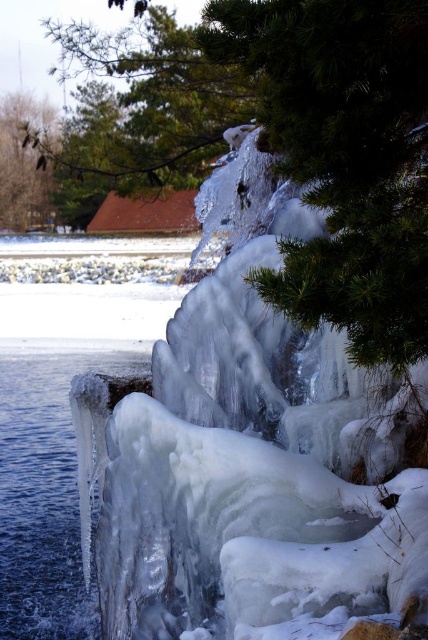
You are an ice climber planning to set up a safety anchor between the clear ice water at lower left and the green textured pine branch at upper left. Given that your anchor requires a minimum distance of 10 feet between the two points, will this location work?

The distance between the clear ice water at lower left and the green textured pine branch at upper left is 11.31 feet, which exceeds the required 10 feet. Therefore, this location is suitable for setting up the safety anchor.

You are standing at the base of the frozen waterfall and want to take a photo of the green matte tree at upper center. Which direction should you face to ensure the tree is in the center of your view?

The green matte tree at upper center is located at point coordinates, so you should face towards the upper center direction to capture it in the center of your view.

Based on the photo, you are standing at the point marked as point (x=44, y=490) in the image. Looking around, you see clear ice water at lower left and the frozen waterfall. Which direction should you move to reach the clear ice water at lower left?

Since point (x=44, y=490) is on clear ice water at lower left, you are already on the clear ice water at lower left.